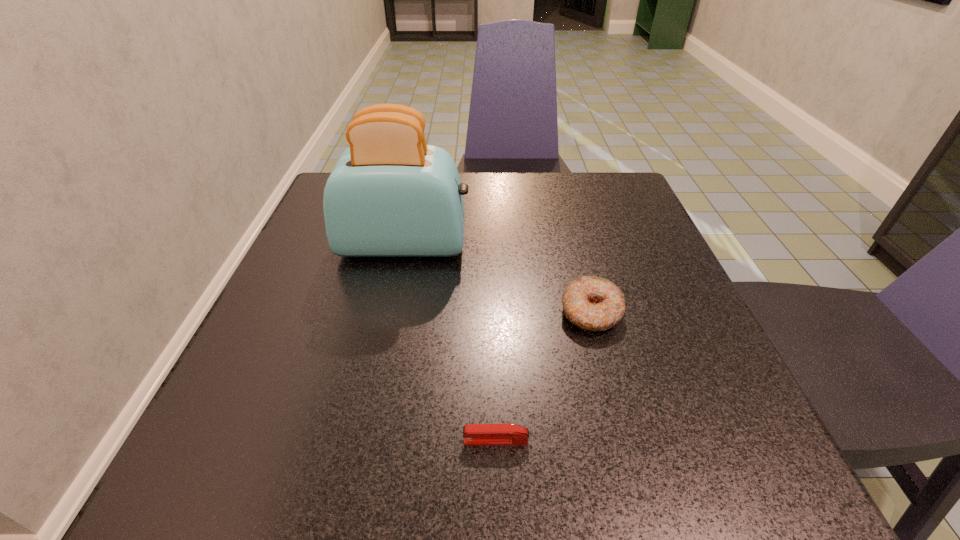
Locate an element on the screen. This screenshot has width=960, height=540. the tallest object is located at coordinates pyautogui.click(x=390, y=194).

Find the location of a particular element. toaster is located at coordinates [390, 194].

The image size is (960, 540). Identify the location of the second shortest object. (591, 303).

You are a GUI agent. You are given a task and a screenshot of the screen. Output one action in this format:
    pyautogui.click(x=<x>, y=<y>)
    Task: Click on the second farthest object
    
    Given the screenshot: What is the action you would take?
    pyautogui.click(x=591, y=303)

This screenshot has width=960, height=540. Identify the location of the second object from right to left. (474, 434).

Image resolution: width=960 pixels, height=540 pixels. In order to click on the shortest object in this screenshot , I will do `click(474, 434)`.

Find the location of `free region located on the side of the toaster with the lever`. free region located on the side of the toaster with the lever is located at coordinates (662, 245).

Locate an element on the screen. Image resolution: width=960 pixels, height=540 pixels. vacant space located 0.080m on the left of the doughnut is located at coordinates (513, 312).

Image resolution: width=960 pixels, height=540 pixels. Find the location of `vacant space located 0.090m on the front-facing side of the stapler`. vacant space located 0.090m on the front-facing side of the stapler is located at coordinates (396, 441).

You are a GUI agent. You are given a task and a screenshot of the screen. Output one action in this format:
    pyautogui.click(x=<x>, y=<y>)
    Task: Click on the vacant space located on the front-facing side of the stapler
    
    Given the screenshot: What is the action you would take?
    pyautogui.click(x=336, y=441)